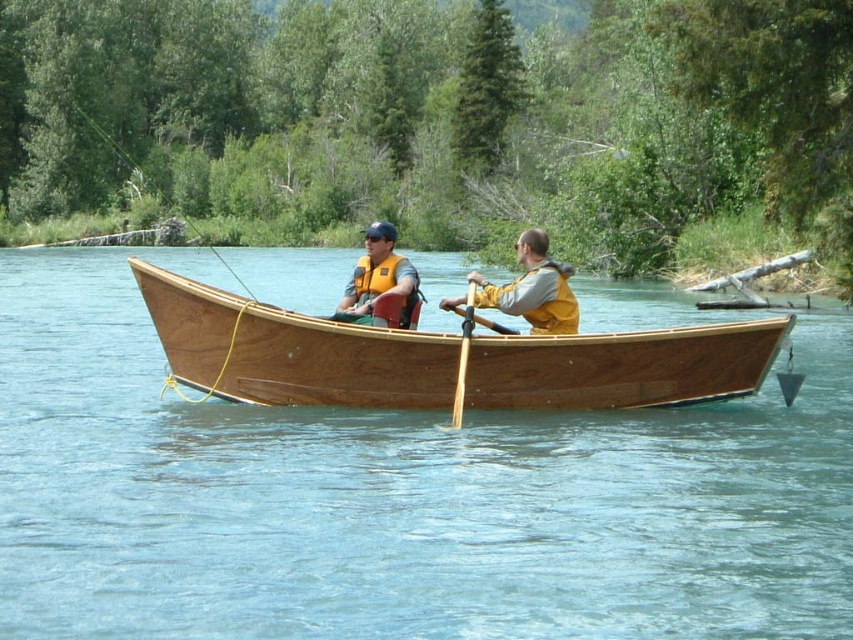
Who is positioned more to the left, yellow life vest at center or matte yellow life vest at center?

matte yellow life vest at center is more to the left.

Is yellow life vest at center taller than matte yellow life vest at center?

Incorrect, yellow life vest at center's height is not larger of matte yellow life vest at center's.

Where is `yellow life vest at center`? The width and height of the screenshot is (853, 640). yellow life vest at center is located at coordinates (532, 289).

Between matte yellow life jacket at center and wooden paddle at center, which one appears on the right side from the viewer's perspective?

wooden paddle at center is more to the right.

Who is more distant from viewer, (415, 276) or (471, 316)?

Point (415, 276)

Is point (384, 269) less distant than point (461, 384)?

No.

Where is `matte yellow life jacket at center`? The height and width of the screenshot is (640, 853). matte yellow life jacket at center is located at coordinates (379, 276).

Is matte yellow life vest at center to the right of wooden paddle at center from the viewer's perspective?

Incorrect, matte yellow life vest at center is not on the right side of wooden paddle at center.

In the scene shown: Can you confirm if matte yellow life vest at center is positioned above wooden paddle at center?

Yes.

In order to click on matte yellow life vest at center in this screenshot , I will do `click(379, 278)`.